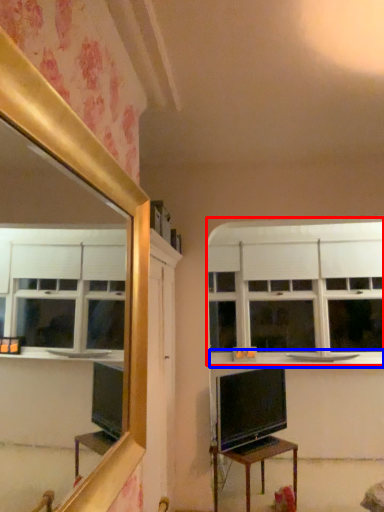
Question: Which object appears farthest to the camera in this image, window (highlighted by a red box) or counter top (highlighted by a blue box)?

Choices:
 (A) window
 (B) counter top

Answer: (A)